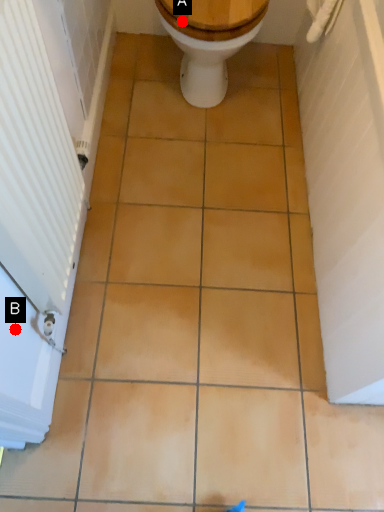
Question: Two points are circled on the image, labeled by A and B beside each circle. Which point appears closest to the camera in this image?

Choices:
 (A) A is closer
 (B) B is closer

Answer: (B)